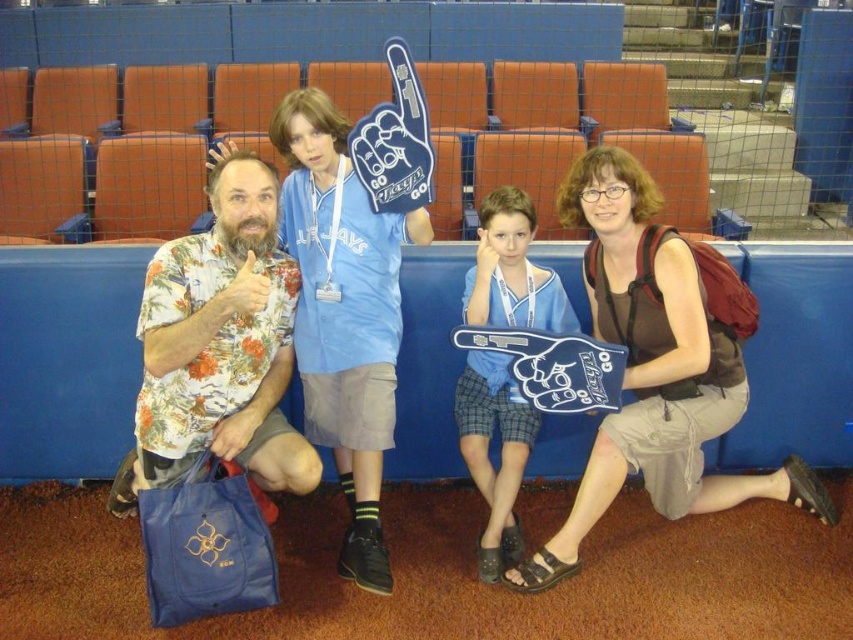
Question: Can you confirm if blue foam finger at center is positioned below brown fabric backpack at lower right?

Choices:
 (A) yes
 (B) no

Answer: (A)

Question: Which point is closer to the camera?

Choices:
 (A) (543, 291)
 (B) (589, 282)
 (C) (625, 422)

Answer: (C)

Question: Which point is farther from the camera taking this photo?

Choices:
 (A) (155, 356)
 (B) (689, 266)
 (C) (480, 252)
 (D) (459, 422)

Answer: (D)

Question: Is floral print shirt at left wider than blue fabric foam finger at center?

Choices:
 (A) no
 (B) yes

Answer: (B)

Question: Is floral print shirt at left to the left of blue fabric foam finger at center from the viewer's perspective?

Choices:
 (A) no
 (B) yes

Answer: (B)

Question: Estimate the real-world distances between objects in this image. Which object is farther from the floral print shirt at left?

Choices:
 (A) blue foam finger at center
 (B) brown fabric backpack at lower right

Answer: (B)